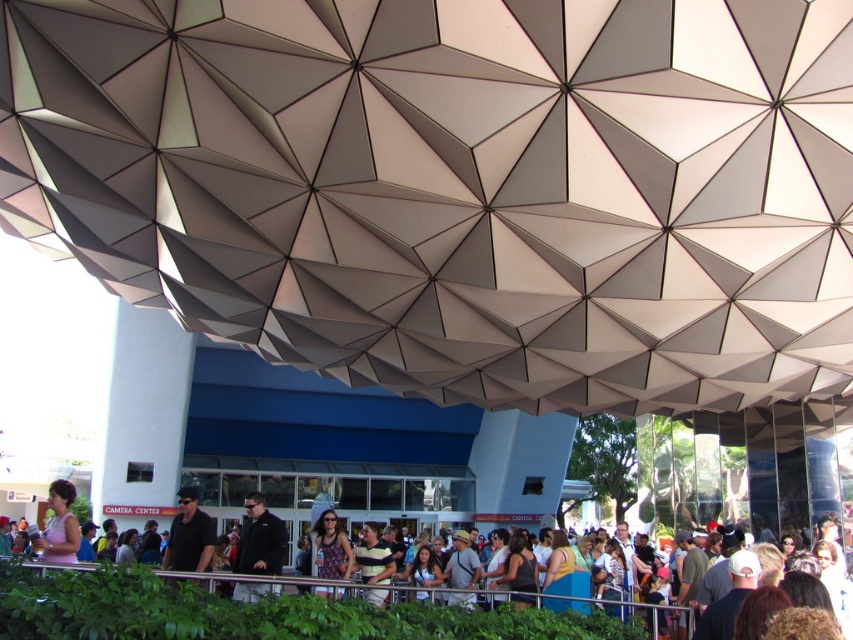
Question: Among these objects, which one is nearest to the camera?

Choices:
 (A) dark gray fabric shirt at center
 (B) pink fabric dress at lower left
 (C) black matte jacket at center

Answer: (B)

Question: Is dark gray fabric shirt at center below pink fabric dress at lower left?

Choices:
 (A) no
 (B) yes

Answer: (A)

Question: Estimate the real-world distances between objects in this image. Which object is farther from the dark gray fabric shirt at center?

Choices:
 (A) pink fabric dress at lower left
 (B) printed fabric dress at center

Answer: (A)

Question: Which point is farther to the camera?

Choices:
 (A) (193, 541)
 (B) (328, 563)

Answer: (B)

Question: Does pink fabric dress at lower left have a larger size compared to printed fabric dress at center?

Choices:
 (A) yes
 (B) no

Answer: (A)

Question: Can you confirm if black matte jacket at center is smaller than dark gray fabric shirt at center?

Choices:
 (A) no
 (B) yes

Answer: (B)